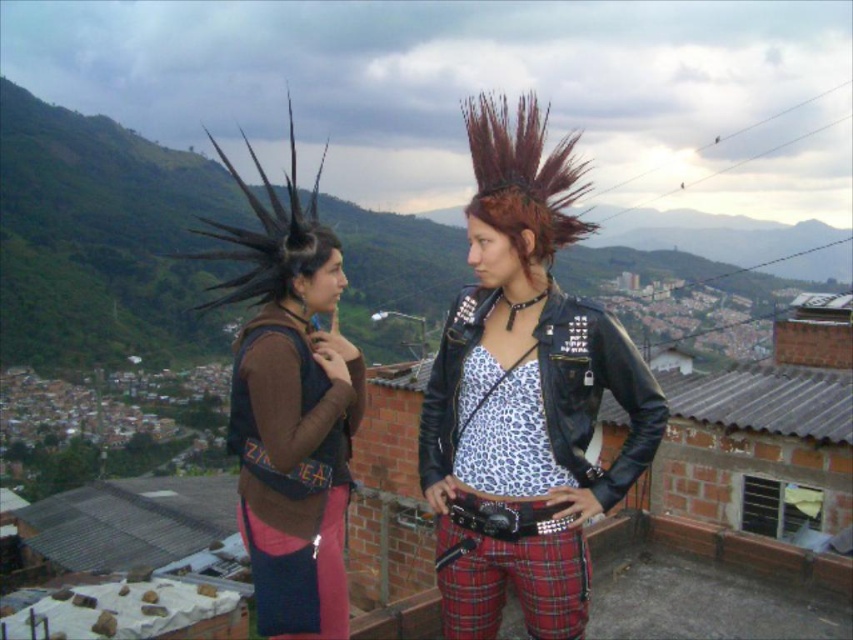
Is leather jacket at center taller than black leather jacket at center?

Yes.

Does leather jacket at center have a smaller size compared to black leather jacket at center?

No.

Who is more distant from viewer, (554, 614) or (548, 314)?

Positioned behind is point (548, 314).

I want to click on leather jacket at center, so click(523, 396).

What do you see at coordinates (595, 392) in the screenshot?
I see `black leather jacket at center` at bounding box center [595, 392].

Is black leather jacket at center taller than dark brown mohawk at center?

In fact, black leather jacket at center may be shorter than dark brown mohawk at center.

This screenshot has height=640, width=853. Find the location of `black leather jacket at center`. black leather jacket at center is located at coordinates (x=595, y=392).

Locate an element on the screen. This screenshot has height=640, width=853. black leather jacket at center is located at coordinates (595, 392).

Which is below, leather jacket at center or dark brown mohawk at center?

leather jacket at center

Between point (538, 118) and point (534, 177), which one is positioned behind?

The point (538, 118) is more distant.

Is point (532, 317) farther from viewer compared to point (502, 102)?

No, (532, 317) is in front of (502, 102).

At what (x,y) coordinates should I click in order to perform the action: click on leather jacket at center. Please return your answer as a coordinate pair (x, y). Looking at the image, I should click on (523, 396).